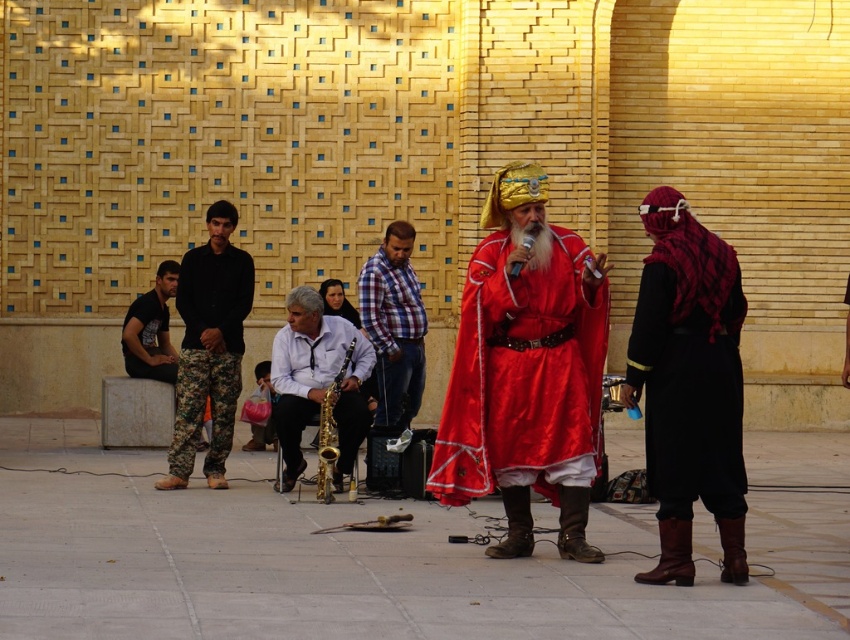
You are a photographer positioned in front of the blue and yellow tiled wall. You want to take a photo that includes both the black woolen robe at right and the black cotton shirt at left. Which object should you focus on first to ensure both are in sharp focus?

The black woolen robe at right is closer to the viewer than the black cotton shirt at left. To ensure both are in sharp focus, focus on the black woolen robe at right first since it is closer.

You are a photographer trying to capture a photo of both the plaid fabric shirt at center and the black cotton shirt at left. Which shirt should you focus on first to ensure both are in focus?

You should focus on the plaid fabric shirt at center first because it is closer to the viewer than the black cotton shirt at left, so adjusting the focus from near to far will help both shirts be in focus.

Consider the image. You are standing at the point marked as point (394, 324) in the image. What object is located exactly at that point?

The plaid fabric shirt at center is located exactly at point (394, 324).